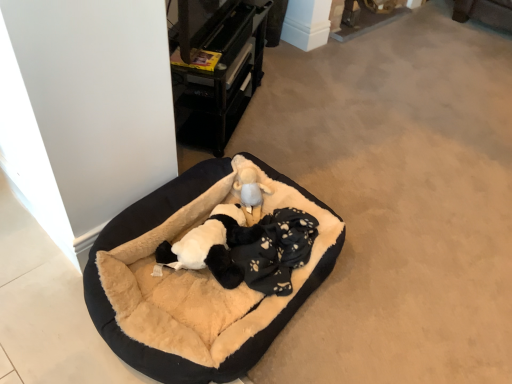
Question: Considering the positions of point (229, 3) and point (184, 274), is point (229, 3) closer or farther from the camera than point (184, 274)?

Choices:
 (A) farther
 (B) closer

Answer: (A)

Question: Is black plastic drawer at upper center spatially inside black plush dog bed at center, or outside of it?

Choices:
 (A) outside
 (B) inside

Answer: (A)

Question: Which of these objects is positioned closest to the black plush dog at center?

Choices:
 (A) black plastic drawer at upper center
 (B) black plush dog bed at center
 (C) fluffy beige stuffed animal at center

Answer: (B)

Question: Considering the real-world distances, which object is closest to the fluffy beige stuffed animal at center?

Choices:
 (A) black plush dog bed at center
 (B) black plush dog at center
 (C) black plastic drawer at upper center

Answer: (B)